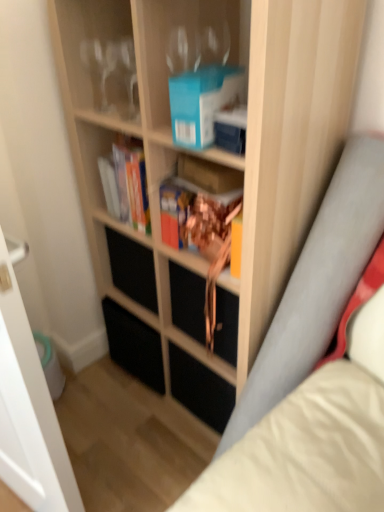
Question: Is wooden bookcase at center taller or shorter than transparent glass door at left?

Choices:
 (A) short
 (B) tall

Answer: (B)

Question: From a real-world perspective, is wooden bookcase at center physically located above or below transparent glass door at left?

Choices:
 (A) above
 (B) below

Answer: (A)

Question: Estimate the real-world distances between objects in this image. Which object is farther from the clear glass wine glasses at upper left?

Choices:
 (A) hardcover book at center, which appears as the second book when viewed from the front
 (B) wooden bookcase at center
 (C) transparent glass door at left
 (D) hardcover book at center, the 2th book when ordered from left to right
 (E) blue matte paperback book at upper center

Answer: (C)

Question: Which object is positioned farthest from the hardcover book at center, placed as the 1th book when sorted from left to right?

Choices:
 (A) hardcover book at center, the 2th book when ordered from left to right
 (B) wooden bookcase at center
 (C) black matte drawer at center
 (D) transparent glass door at left
 (E) blue matte paperback book at upper center

Answer: (D)